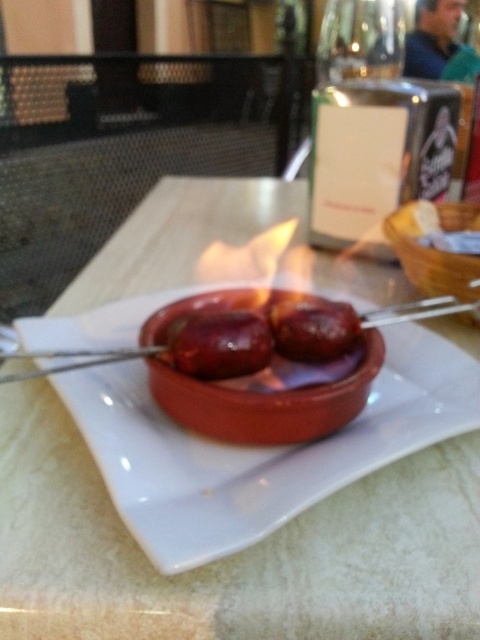
Question: Can you confirm if matte clay bowl at center is positioned to the left of matte ceramic bowl at center?

Choices:
 (A) yes
 (B) no

Answer: (A)

Question: Is matte ceramic plate at center to the right of matte clay bowl at center from the viewer's perspective?

Choices:
 (A) yes
 (B) no

Answer: (A)

Question: Which point is closer to the camera taking this photo?

Choices:
 (A) tap(196, 493)
 (B) tap(420, 205)
 (C) tap(230, 372)
 (D) tap(348, 316)

Answer: (A)

Question: Does matte clay bowl at center appear on the right side of matte ceramic bowl at center?

Choices:
 (A) yes
 (B) no

Answer: (B)

Question: Which object appears closest to the camera in this image?

Choices:
 (A) matte ceramic bowl at center
 (B) glossy brown sausage at center
 (C) matte clay bowl at center
 (D) matte ceramic plate at center

Answer: (D)

Question: Which of the following is the farthest from the observer?

Choices:
 (A) (276, 340)
 (B) (469, 292)
 (C) (182, 362)

Answer: (B)